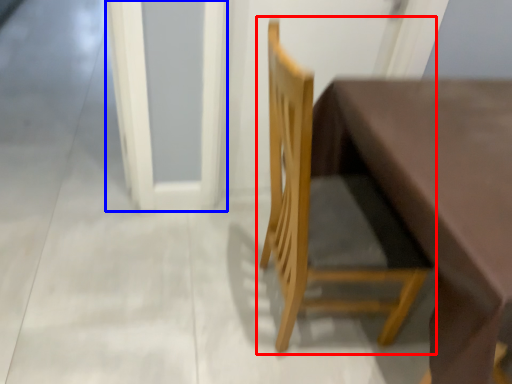
Question: Which point is closer to the camera, chair (highlighted by a red box) or screen door (highlighted by a blue box)?

Choices:
 (A) chair
 (B) screen door

Answer: (A)